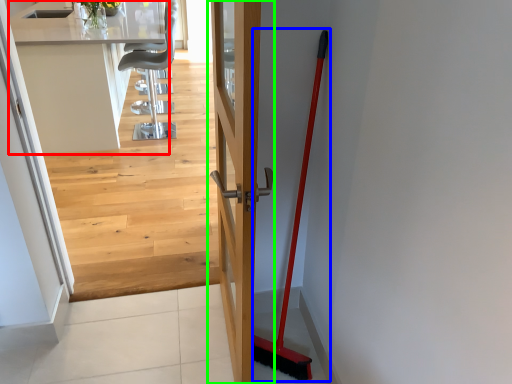
Question: Based on their relative distances, which object is farther from counter top (highlighted by a red box)? Choose from shovel (highlighted by a blue box) and door (highlighted by a green box).

Choices:
 (A) shovel
 (B) door

Answer: (A)